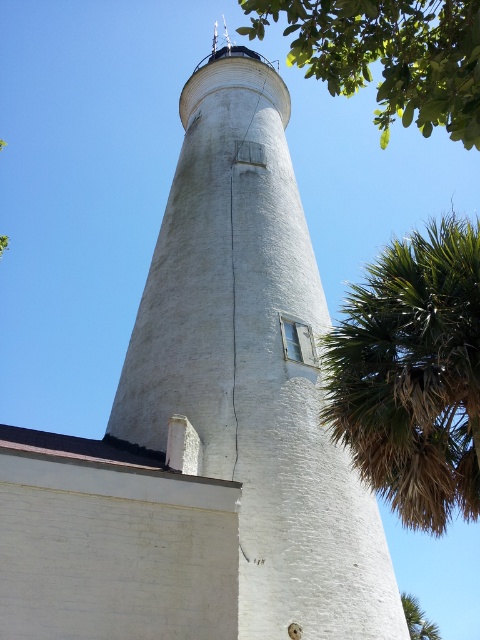
Question: Does white textured tower at center appear on the right side of green leafy palm tree at lower right?

Choices:
 (A) no
 (B) yes

Answer: (A)

Question: Which object appears farthest from the camera in this image?

Choices:
 (A) green leafy tree at upper right
 (B) white textured tower at center
 (C) brown leafy palm tree at right

Answer: (B)

Question: Does white textured tower at center have a larger size compared to green leafy tree at upper right?

Choices:
 (A) no
 (B) yes

Answer: (A)

Question: In this image, where is green leafy tree at upper right located relative to green leafy palm tree at lower right?

Choices:
 (A) below
 (B) above

Answer: (B)

Question: Which point is farther to the camera?

Choices:
 (A) (421, 611)
 (B) (437, 321)

Answer: (A)

Question: Which point is farther from the camera taking this photo?

Choices:
 (A) (206, 96)
 (B) (421, 52)
 (C) (448, 509)
 (D) (404, 602)

Answer: (A)